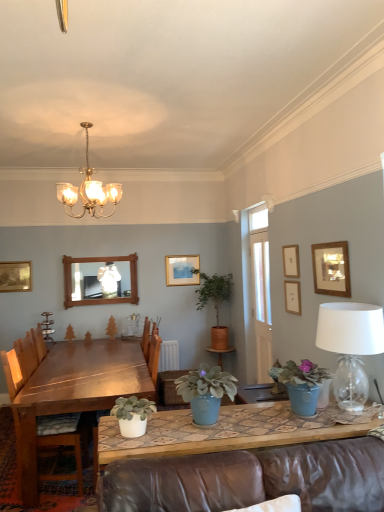
Question: In terms of size, does wooden chair at left appear bigger or smaller than green matte plant at center, the first plant in the right-to-left sequence?

Choices:
 (A) small
 (B) big

Answer: (B)

Question: From a real-world perspective, relative to green matte plant at center, which is the 1th plant in back-to-front order, is wooden chair at left vertically above or below?

Choices:
 (A) below
 (B) above

Answer: (A)

Question: Which is nearer to the gold-framed picture at upper left, which ranks as the 2th picture frame in back-to-front order?

Choices:
 (A) white matte pot at lower center, positioned as the 4th houseplant in back-to-front order
 (B) wooden picture frame at upper center, which is counted as the fourth picture frame, starting from the left
 (C) matte gold picture frame at upper center, arranged as the 1th picture frame when viewed from the back
 (D) clear glass lampshade at right
 (E) wooden mirror at upper center

Answer: (E)

Question: Based on their relative distances, which object is farther from the green matte plant at center, which is the 1th plant in back-to-front order?

Choices:
 (A) gold-framed picture at upper left, acting as the fifth picture frame starting from the right
 (B) white matte pot at lower center, marked as the 1th houseplant in a front-to-back arrangement
 (C) wooden picture frame at upper center, which appears as the fourth picture frame when viewed from the back
 (D) wooden picture frame at upper right, the first picture frame when ordered from right to left
 (E) wooden picture frame at upper center, the second picture frame from the right

Answer: (B)